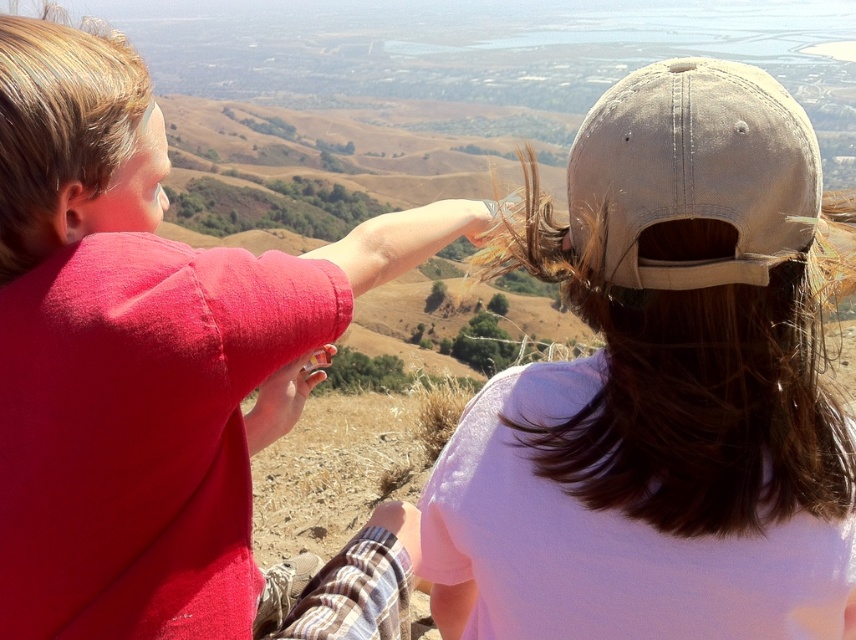
Between matte red shirt at upper left and brown matte hair at upper right, which one has more height?

matte red shirt at upper left

The image size is (856, 640). I want to click on matte red shirt at upper left, so [x=162, y=374].

Can you confirm if light brown fabric baseball cap at upper right is positioned below blonde smooth hair at upper left?

Correct, light brown fabric baseball cap at upper right is located below blonde smooth hair at upper left.

Is light brown fabric baseball cap at upper right above blonde smooth hair at upper left?

No.

The height and width of the screenshot is (640, 856). I want to click on light brown fabric baseball cap at upper right, so click(694, 172).

What do you see at coordinates (693, 388) in the screenshot? The width and height of the screenshot is (856, 640). I see `brown matte hair at upper right` at bounding box center [693, 388].

Is point (825, 413) farther from camera compared to point (747, 212)?

That is True.

Where is `brown matte hair at upper right`? brown matte hair at upper right is located at coordinates (693, 388).

What are the coordinates of `brown matte hair at upper right` in the screenshot? It's located at (693, 388).